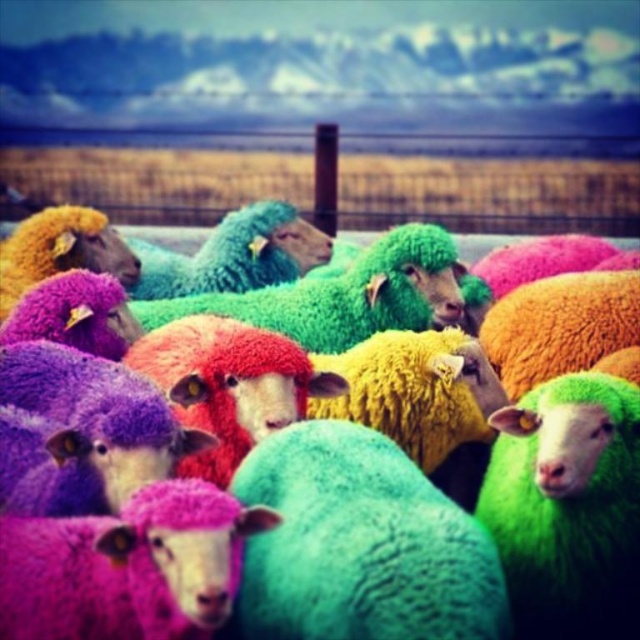
Question: In this image, where is green fuzzy sheep at center located relative to metallic wire fence at upper center?

Choices:
 (A) below
 (B) above

Answer: (A)

Question: Is green fuzzy sheep at center to the left of metallic wire fence at upper center from the viewer's perspective?

Choices:
 (A) yes
 (B) no

Answer: (A)

Question: Among these objects, which one is nearest to the camera?

Choices:
 (A) metallic wire fence at upper center
 (B) green fuzzy sheep at center

Answer: (B)

Question: Is green fuzzy sheep at center to the left of metallic wire fence at upper center from the viewer's perspective?

Choices:
 (A) no
 (B) yes

Answer: (B)

Question: Which point is farther from the camera taking this photo?

Choices:
 (A) (621, 557)
 (B) (186, 173)

Answer: (B)